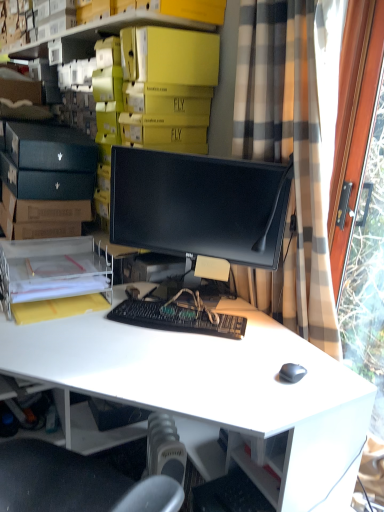
This screenshot has height=512, width=384. Describe the element at coordinates (199, 205) in the screenshot. I see `black matte monitor at center` at that location.

Measure the distance between point [18,292] and camera.

The distance of point [18,292] from camera is 4.52 feet.

Measure the distance between point (212, 326) and camera.

Point (212, 326) is 4.64 feet from camera.

Locate an element on the screen. white matte desk at center is located at coordinates (215, 388).

Describe the element at coordinates (98, 36) in the screenshot. I see `yellow cardboard boxes at upper center` at that location.

In order to click on black matte monitor at center in this screenshot , I will do `click(199, 205)`.

Would you say yellow cardboard boxes at upper center is outside white matte desk at center?

yellow cardboard boxes at upper center is positioned outside white matte desk at center.

Can you confirm if yellow cardboard boxes at upper center is positioned to the right of white matte desk at center?

No, yellow cardboard boxes at upper center is not to the right of white matte desk at center.

Is yellow cardboard boxes at upper center looking in the opposite direction of white matte desk at center?

No, yellow cardboard boxes at upper center's orientation is not away from white matte desk at center.

From a real-world perspective, does plaid fabric curtain at right sit lower than black matte monitor at center?

Incorrect, from a real-world perspective, plaid fabric curtain at right is higher than black matte monitor at center.

Is black matte monitor at center inside plaid fabric curtain at right?

That's correct, black matte monitor at center is inside plaid fabric curtain at right.

Considering the sizes of objects plaid fabric curtain at right and black matte monitor at center in the image provided, who is smaller, plaid fabric curtain at right or black matte monitor at center?

Smaller between the two is black matte monitor at center.

Is plaid fabric curtain at right closer to camera compared to black matte monitor at center?

Yes.

Based on the photo, is plaid fabric curtain at right positioned with its back to black matte keyboard at center?

No, plaid fabric curtain at right is not facing away from black matte keyboard at center.

Which object is thinner, plaid fabric curtain at right or black matte keyboard at center?

black matte keyboard at center.

Is plaid fabric curtain at right next to black matte keyboard at center?

No, plaid fabric curtain at right is not touching black matte keyboard at center.

Is plaid fabric curtain at right at the right side of black matte keyboard at center?

Yes.

Measure the distance from black matte keyboard at center to white matte desk at center.

7.96 inches.

From a real-world perspective, is black matte keyboard at center above or below white matte desk at center?

From a real-world perspective, black matte keyboard at center is physically above white matte desk at center.

Considering the positions of objects black matte keyboard at center and white matte desk at center in the image provided, who is more to the right, black matte keyboard at center or white matte desk at center?

Positioned to the right is black matte keyboard at center.

Can you confirm if black matte keyboard at center is thinner than white matte desk at center?

Yes.

Where is `computer monitor above the white matte desk at center (from a real-world perspective)`? The image size is (384, 512). computer monitor above the white matte desk at center (from a real-world perspective) is located at coordinates (199, 205).

Considering the sizes of objects white matte desk at center and black matte monitor at center in the image provided, who is taller, white matte desk at center or black matte monitor at center?

Standing taller between the two is white matte desk at center.

Would you say white matte desk at center is outside black matte monitor at center?

That's correct, white matte desk at center is outside of black matte monitor at center.

Can you tell me how much yellow cardboard boxes at upper center and black matte keyboard at center differ in facing direction?

They differ by 45.3 degrees in their facing directions.

From a real-world perspective, who is located lower, yellow cardboard boxes at upper center or black matte keyboard at center?

black matte keyboard at center.

The width and height of the screenshot is (384, 512). Find the location of `computer keyboard that is below the yellow cardboard boxes at upper center (from the image's perspective)`. computer keyboard that is below the yellow cardboard boxes at upper center (from the image's perspective) is located at coordinates (176, 318).

Choose the correct answer: Is yellow cardboard boxes at upper center inside black matte keyboard at center or outside it?

yellow cardboard boxes at upper center is outside black matte keyboard at center.

From their relative heights in the image, would you say black matte monitor at center is taller or shorter than yellow cardboard boxes at upper center?

Considering their sizes, black matte monitor at center has less height than yellow cardboard boxes at upper center.

Looking at this image, from a real-world perspective, who is located higher, black matte monitor at center or yellow cardboard boxes at upper center?

yellow cardboard boxes at upper center is physically above.

Considering the positions of objects black matte monitor at center and yellow cardboard boxes at upper center in the image provided, who is more to the right, black matte monitor at center or yellow cardboard boxes at upper center?

black matte monitor at center.

Is black matte monitor at center thinner than yellow cardboard boxes at upper center?

Correct, the width of black matte monitor at center is less than that of yellow cardboard boxes at upper center.

The image size is (384, 512). In order to click on bookshelf located above the white matte desk at center (from the image's perspective) in this screenshot , I will do `click(98, 36)`.

I want to click on computer monitor lying on the left of plaid fabric curtain at right, so click(199, 205).

Looking at the image, which one is located further to white matte desk at center, clear plastic file at lower left or yellow cardboard boxes at upper center?

Among the two, yellow cardboard boxes at upper center is located further to white matte desk at center.

Considering their positions, is yellow cardboard boxes at upper center positioned further to black matte keyboard at center than white matte desk at center?

yellow cardboard boxes at upper center.

Considering their positions, is plaid fabric curtain at right positioned further to yellow cardboard boxes at upper center than clear plastic file at lower left?

clear plastic file at lower left is positioned further to the anchor yellow cardboard boxes at upper center.

Estimate the real-world distances between objects in this image. Which object is closer to clear plastic file at lower left, black matte monitor at center or plaid fabric curtain at right?

Based on the image, black matte monitor at center appears to be nearer to clear plastic file at lower left.

Which object lies nearer to the anchor point clear plastic file at lower left, white matte desk at center or plaid fabric curtain at right?

white matte desk at center lies closer to clear plastic file at lower left than the other object.

Based on their spatial positions, is yellow cardboard boxes at upper center or white matte desk at center closer to clear plastic file at lower left?

Among the two, white matte desk at center is located nearer to clear plastic file at lower left.

Considering their positions, is black matte keyboard at center positioned further to plaid fabric curtain at right than white matte desk at center?

Among the two, black matte keyboard at center is located further to plaid fabric curtain at right.

When comparing their distances from yellow cardboard boxes at upper center, does black matte monitor at center or black matte keyboard at center seem further?

The object further to yellow cardboard boxes at upper center is black matte keyboard at center.

At what (x,y) coordinates should I click in order to perform the action: click on computer keyboard between yellow cardboard boxes at upper center and white matte desk at center from top to bottom. Please return your answer as a coordinate pair (x, y). This screenshot has height=512, width=384. Looking at the image, I should click on (176, 318).

Identify the location of book between plaid fabric curtain at right and white matte desk at center in the vertical direction. (51, 270).

Where is `computer monitor between yellow cardboard boxes at upper center and white matte desk at center vertically`? Image resolution: width=384 pixels, height=512 pixels. computer monitor between yellow cardboard boxes at upper center and white matte desk at center vertically is located at coordinates (199, 205).

Locate an element on the screen. computer monitor between plaid fabric curtain at right and black matte keyboard at center from top to bottom is located at coordinates (199, 205).